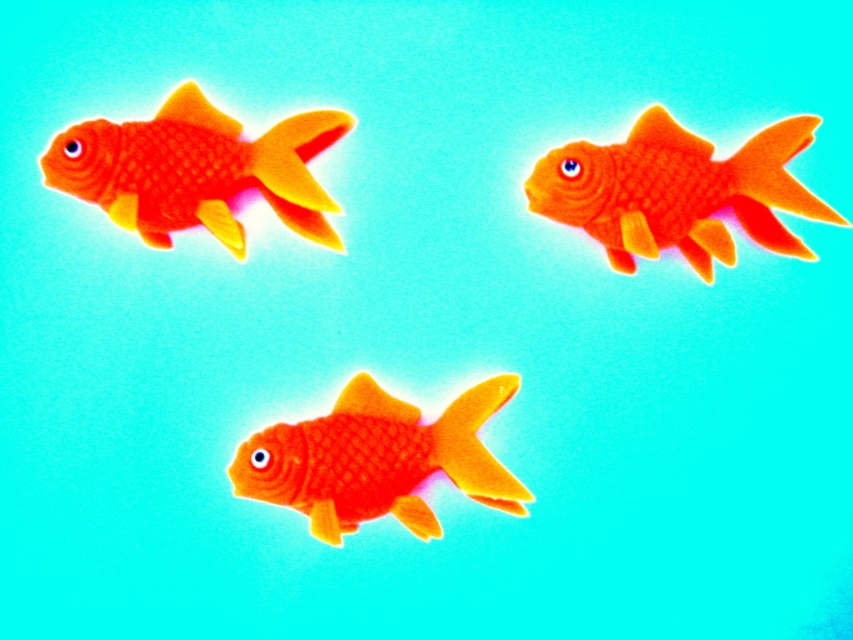
Question: Among these objects, which one is nearest to the camera?

Choices:
 (A) matte orange goldfish at center
 (B) matte orange goldfish at upper right
 (C) matte orange goldfish at upper left

Answer: (C)

Question: Which object is positioned closest to the matte orange goldfish at center?

Choices:
 (A) matte orange goldfish at upper right
 (B) matte orange goldfish at upper left

Answer: (B)

Question: Is matte orange goldfish at upper right positioned before matte orange goldfish at center?

Choices:
 (A) yes
 (B) no

Answer: (B)

Question: Which of the following is the farthest from the observer?

Choices:
 (A) (686, 250)
 (B) (91, 145)
 (C) (456, 444)

Answer: (C)

Question: Can you confirm if matte orange goldfish at upper right is positioned below matte orange goldfish at upper left?

Choices:
 (A) yes
 (B) no

Answer: (A)

Question: Is matte orange goldfish at upper right further to camera compared to matte orange goldfish at center?

Choices:
 (A) yes
 (B) no

Answer: (A)